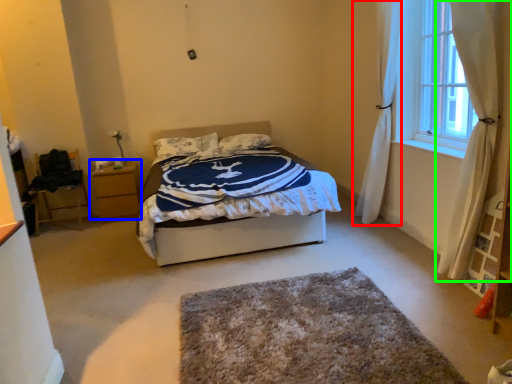
Question: Which object is the closest to the curtain (highlighted by a red box)? Choose among these: nightstand (highlighted by a blue box) or curtain (highlighted by a green box).

Choices:
 (A) nightstand
 (B) curtain

Answer: (B)